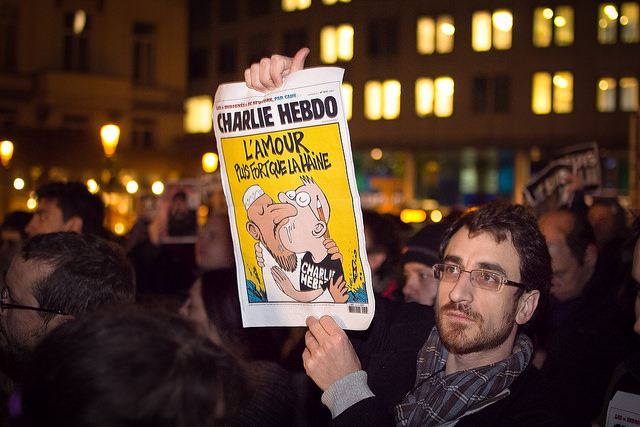
Locate an element on the screen. The width and height of the screenshot is (640, 427). newspaper is located at coordinates (582, 162), (547, 173), (319, 198), (202, 198).